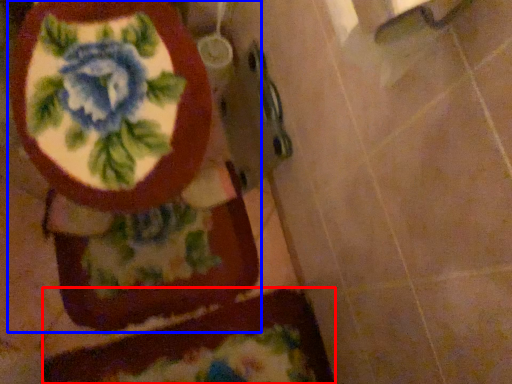
Question: Which of the following is the closest to the observer, bath mat (highlighted by a red box) or toilet (highlighted by a blue box)?

Choices:
 (A) bath mat
 (B) toilet

Answer: (B)